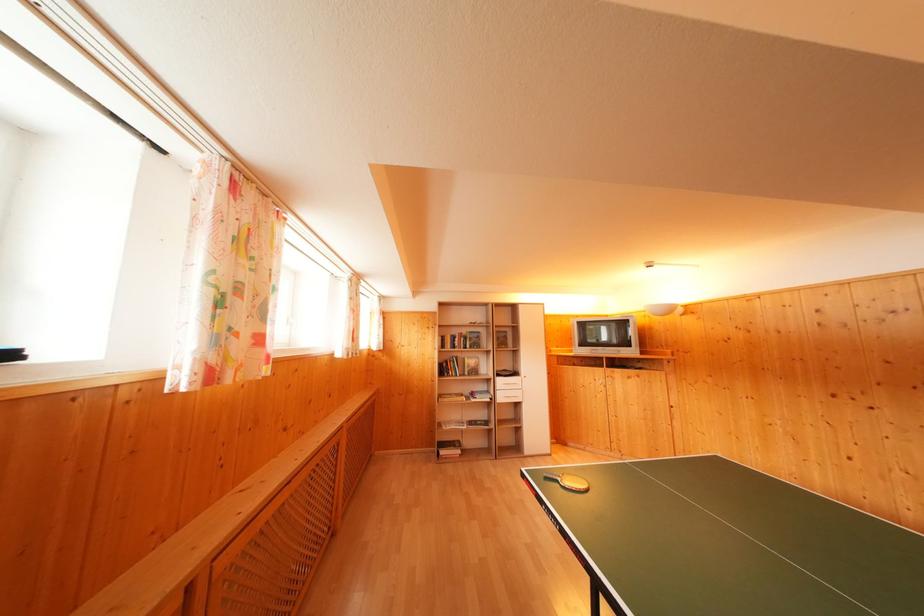
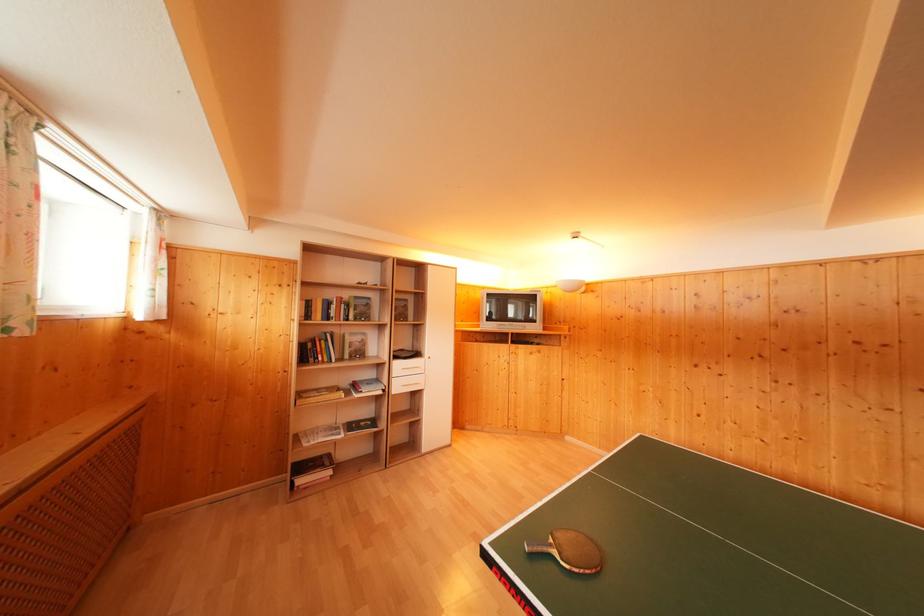
Locate, in the second image, the point that corresponds to point (488, 392) in the first image.

(375, 379)